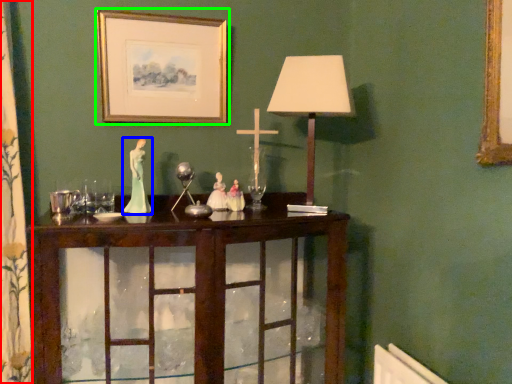
Question: Estimate the real-world distances between objects in this image. Which object is farther from curtain (highlighted by a red box), miniature (highlighted by a blue box) or picture frame (highlighted by a green box)?

Choices:
 (A) miniature
 (B) picture frame

Answer: (B)